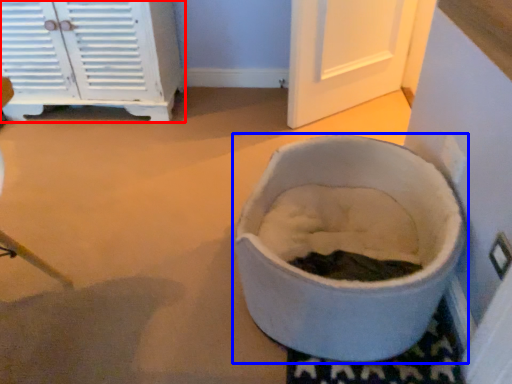
Question: Which of the following is the farthest to the observer, cabinetry (highlighted by a red box) or toilet (highlighted by a blue box)?

Choices:
 (A) cabinetry
 (B) toilet

Answer: (A)